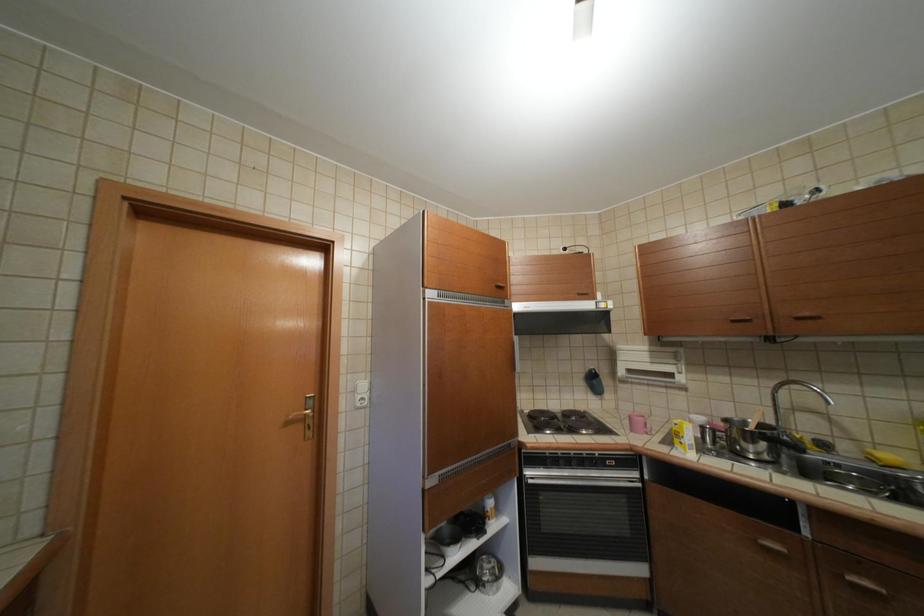
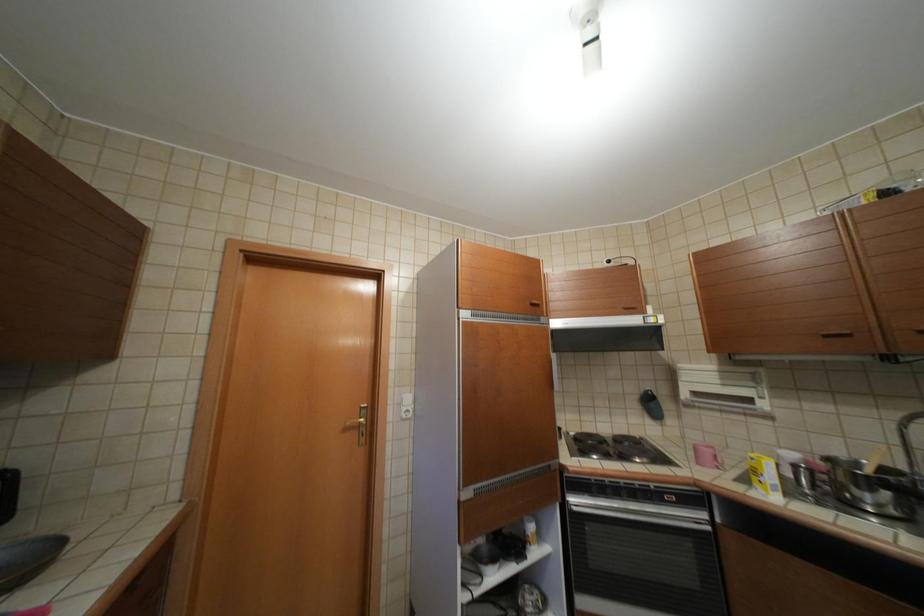
Which direction would the cameraman need to move to produce the second image?

The cameraman walked toward right, backward.